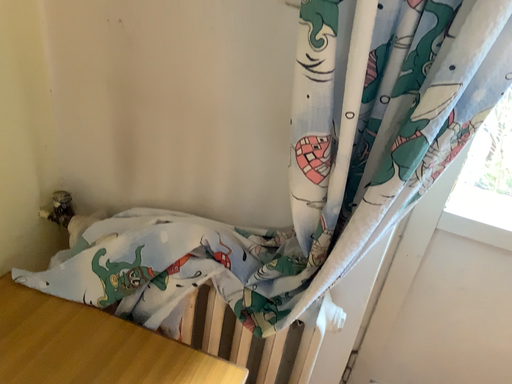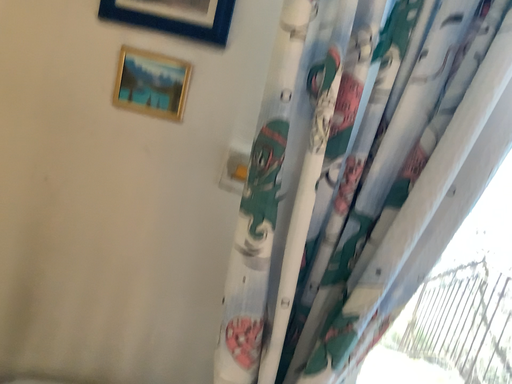
Question: How did the camera likely rotate when shooting the video?

Choices:
 (A) rotated downward
 (B) rotated upward

Answer: (B)